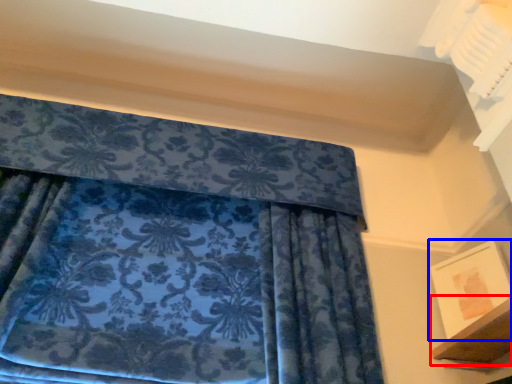
Question: Among these objects, which one is nearest to the camera, shelf (highlighted by a red box) or picture frame (highlighted by a blue box)?

Choices:
 (A) shelf
 (B) picture frame

Answer: (A)